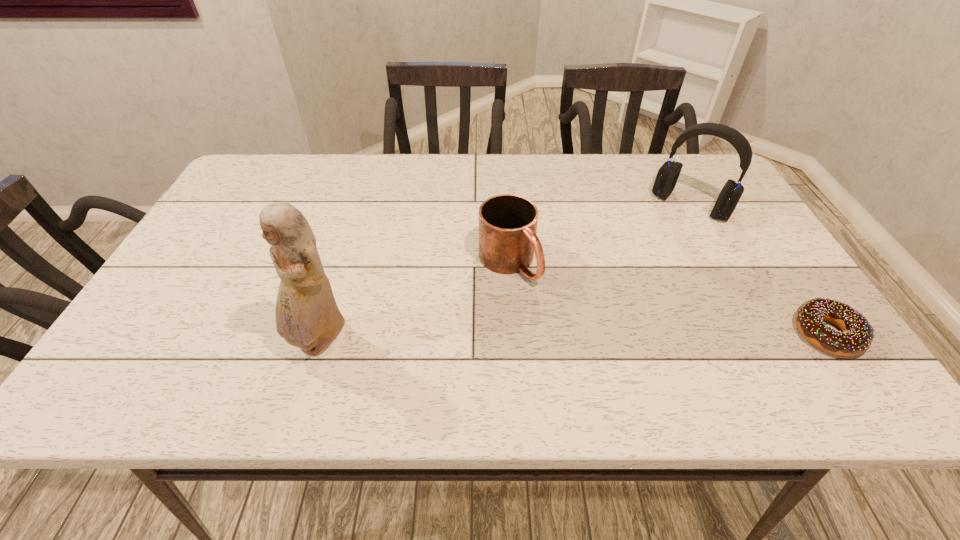
Locate an element on the screen. Image resolution: width=960 pixels, height=540 pixels. vacant space located on the headband of the headset is located at coordinates click(659, 245).

Where is `blank space located 0.050m on the side of the mug with the handle`? Image resolution: width=960 pixels, height=540 pixels. blank space located 0.050m on the side of the mug with the handle is located at coordinates (540, 300).

Image resolution: width=960 pixels, height=540 pixels. Find the location of `vacant space situated on the side of the mug with the handle`. vacant space situated on the side of the mug with the handle is located at coordinates (554, 315).

Locate an element on the screen. free location located on the side of the mug with the handle is located at coordinates (582, 343).

At what (x,y) coordinates should I click in order to perform the action: click on object present at the far edge. Please return your answer as a coordinate pair (x, y). The image size is (960, 540). Looking at the image, I should click on (668, 174).

Find the location of a particular element. The width and height of the screenshot is (960, 540). figurine present at the near edge is located at coordinates (307, 316).

Identify the location of doughnut that is at the near edge. (857, 337).

This screenshot has width=960, height=540. In order to click on doughnut present at the right edge in this screenshot , I will do `click(857, 337)`.

This screenshot has width=960, height=540. What are the coordinates of `headset present at the right edge` in the screenshot? It's located at click(668, 174).

Image resolution: width=960 pixels, height=540 pixels. I want to click on object located in the far right corner section of the desktop, so click(x=668, y=174).